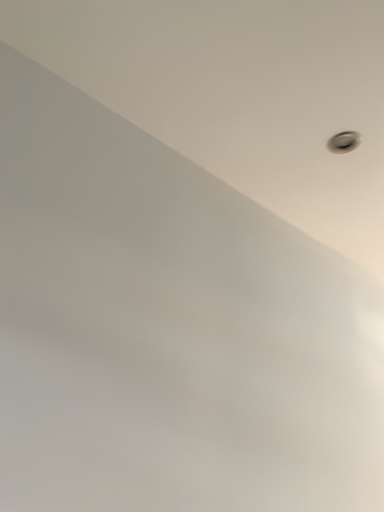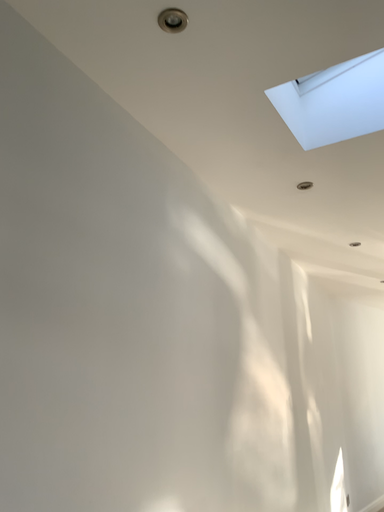
Question: How did the camera likely rotate when shooting the video?

Choices:
 (A) rotated left
 (B) rotated right

Answer: (B)